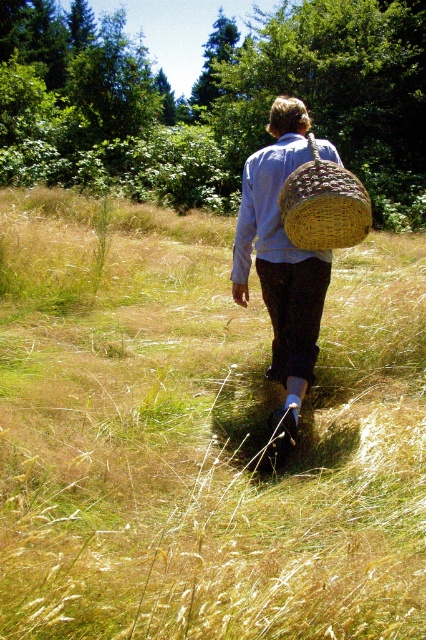
You are a GUI agent. You are given a task and a screenshot of the screen. Output one action in this format:
    pyautogui.click(x=<x>, y=<y>)
    Task: Click on the golden dry grass at center
    This screenshot has width=426, height=640.
    Given the screenshot: What is the action you would take?
    pyautogui.click(x=199, y=435)

Is golden dry grass at center behind woven straw basket at upper center?

That is False.

Between point (204, 419) and point (288, 193), which one is positioned behind?

Positioned behind is point (204, 419).

Find the location of a particular element. golden dry grass at center is located at coordinates (199, 435).

Can you confirm if light blue woven shirt at center is thinner than woven straw basket at upper center?

Yes, light blue woven shirt at center is thinner than woven straw basket at upper center.

Is light blue woven shirt at center positioned behind woven straw basket at upper center?

That is True.

Between point (313, 256) and point (331, 195), which one is positioned in front?

Point (331, 195)

At what (x,y) coordinates should I click in order to perform the action: click on light blue woven shirt at center. Please return your answer as a coordinate pair (x, y). The width and height of the screenshot is (426, 640). Looking at the image, I should click on (267, 208).

Is woven straw basket at center bigger than light blue woven shirt at center?

Indeed, woven straw basket at center has a larger size compared to light blue woven shirt at center.

Who is shorter, woven straw basket at center or light blue woven shirt at center?

With less height is light blue woven shirt at center.

Describe the element at coordinates (282, 257) in the screenshot. Image resolution: width=426 pixels, height=640 pixels. I see `woven straw basket at center` at that location.

This screenshot has height=640, width=426. What are the coordinates of `woven straw basket at center` in the screenshot? It's located at (282, 257).